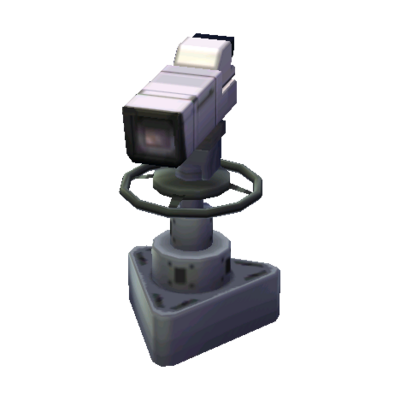
At what (x,y) coordinates should I click in order to perform the action: click on camera eyehole. Please return your answer as a coordinate pair (x, y). This screenshot has width=400, height=400. Looking at the image, I should click on (228, 42).